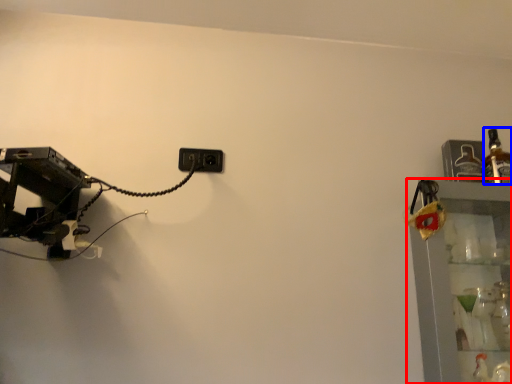
Question: Which point is further to the camera, shelf (highlighted by a red box) or bottle (highlighted by a blue box)?

Choices:
 (A) shelf
 (B) bottle

Answer: (B)